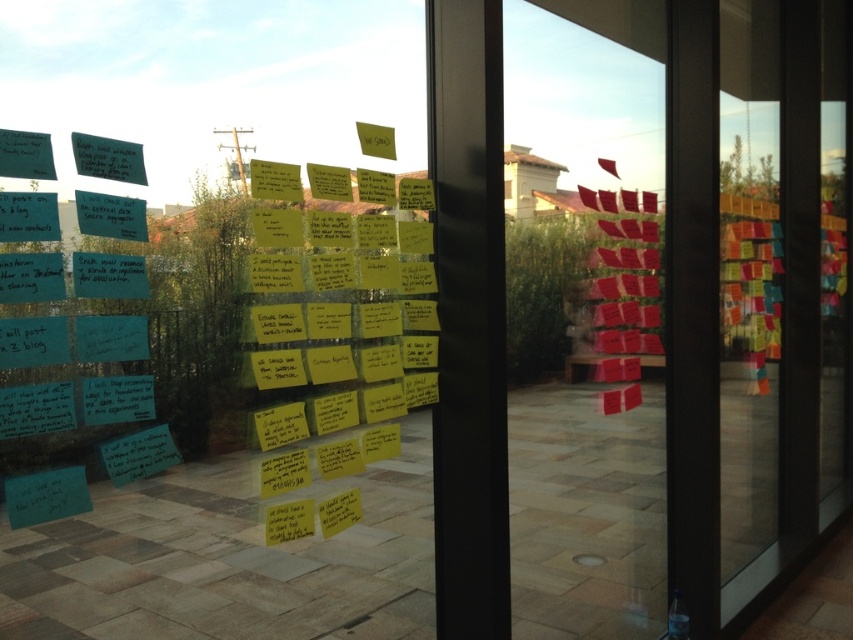
Does point (613, 324) come behind point (129, 182)?

Yes, it is.

Between transparent glass door at center and matte paper sign at upper left, which one appears on the left side from the viewer's perspective?

matte paper sign at upper left is more to the left.

Which is behind, point (498, 262) or point (119, 164)?

Point (498, 262)

Identify the location of transparent glass door at center. This screenshot has width=853, height=640. (637, 307).